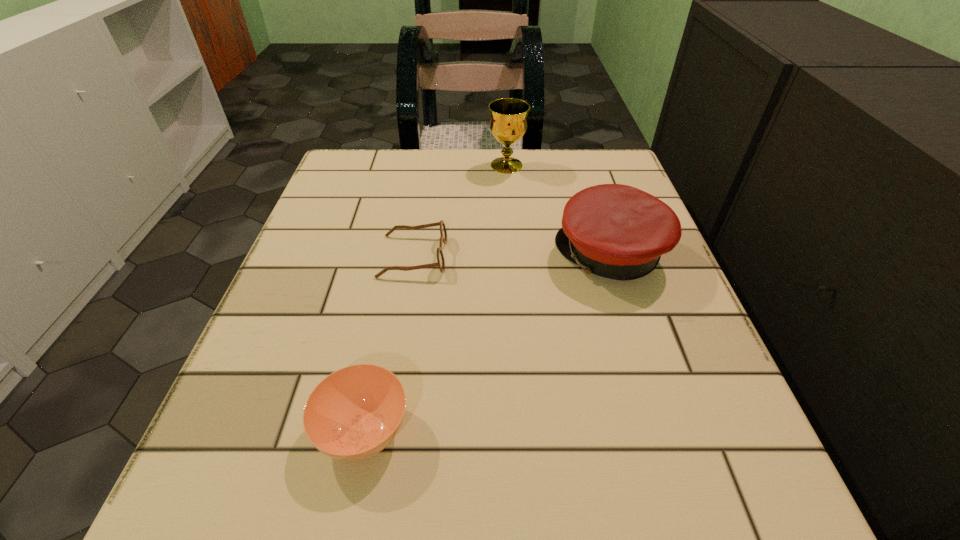
Find the location of a particular element. The width and height of the screenshot is (960, 540). the farthest object is located at coordinates (508, 124).

Where is `chalice`? chalice is located at coordinates click(508, 124).

You are a GUI agent. You are given a task and a screenshot of the screen. Output one action in this format:
    pyautogui.click(x=<x>, y=<y>)
    Task: Click on the cap
    This screenshot has width=960, height=540.
    Given the screenshot: What is the action you would take?
    pyautogui.click(x=616, y=231)

The width and height of the screenshot is (960, 540). Find the location of `the rightmost object`. the rightmost object is located at coordinates (616, 231).

Locate an element on the screen. The image size is (960, 540). soup bowl is located at coordinates (354, 413).

Find the location of a particular element. The width and height of the screenshot is (960, 540). the nearest object is located at coordinates (354, 413).

Locate an element on the screen. This screenshot has height=540, width=960. spectacles is located at coordinates (440, 263).

The width and height of the screenshot is (960, 540). Find the location of `vacant area situated 0.160m on the right of the tallest object`. vacant area situated 0.160m on the right of the tallest object is located at coordinates (593, 165).

Image resolution: width=960 pixels, height=540 pixels. I want to click on vacant space situated 0.080m at the front of the rightmost object where the visor is located, so click(x=514, y=255).

You are a GUI agent. You are given a task and a screenshot of the screen. Output one action in this format:
    pyautogui.click(x=<x>, y=<y>)
    Task: Click on the free region located 0.220m at the front of the rightmost object where the visor is located
    
    Given the screenshot: What is the action you would take?
    pyautogui.click(x=438, y=255)